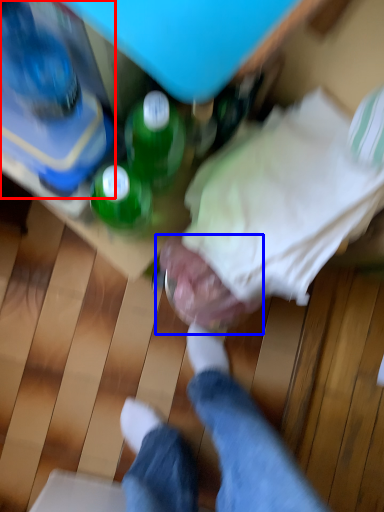
Question: Among these objects, which one is farthest to the camera, bottle (highlighted by a red box) or head (highlighted by a blue box)?

Choices:
 (A) bottle
 (B) head

Answer: (B)